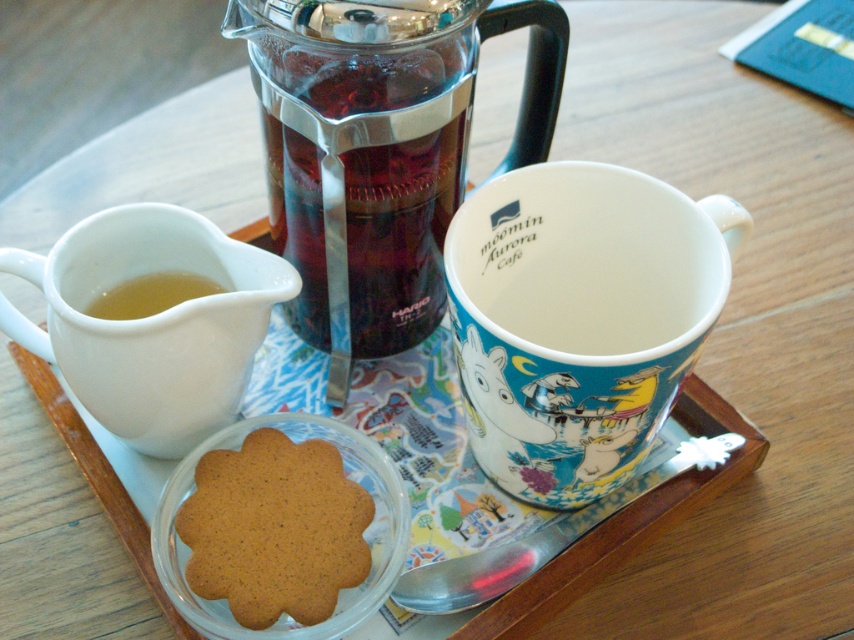
Question: Where is white ceramic mug at upper right located in relation to brown crumbly cookie at center in the image?

Choices:
 (A) above
 (B) below

Answer: (A)

Question: Which of the following is the closest to the observer?

Choices:
 (A) (133, 209)
 (B) (531, 428)

Answer: (B)

Question: Is white ceramic mug at lower left wider than brown crumbly cookie at center?

Choices:
 (A) no
 (B) yes

Answer: (B)

Question: Is brown crumbly cookie at center bigger than translucent glass cup at lower left?

Choices:
 (A) no
 (B) yes

Answer: (B)

Question: Which is farther from the translucent glass cup at lower left?

Choices:
 (A) white ceramic mug at lower left
 (B) brown crumbly cookie at center
 (C) transparent glass tea pot at center
 (D) white ceramic mug at upper right

Answer: (D)

Question: Which of the following is the farthest from the observer?

Choices:
 (A) white ceramic mug at lower left
 (B) white ceramic mug at upper right

Answer: (A)